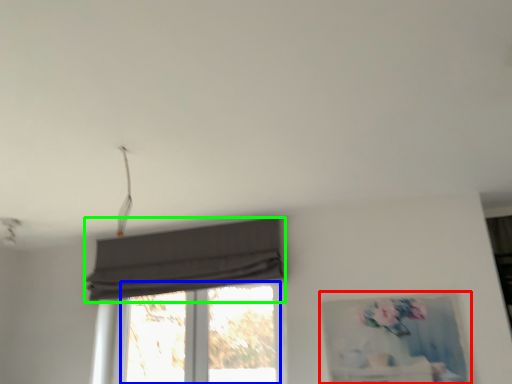
Question: Considering the real-world distances, which object is farthest from picture frame (highlighted by a red box)? window (highlighted by a blue box) or curtain (highlighted by a green box)?

Choices:
 (A) window
 (B) curtain

Answer: (B)